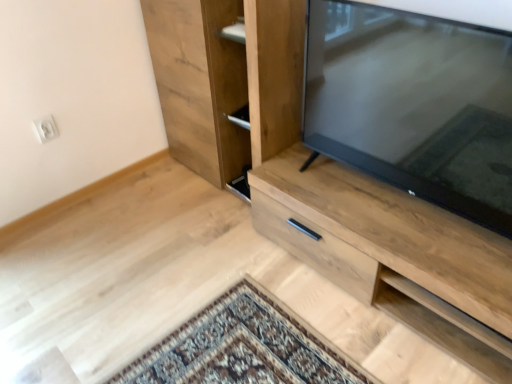
Question: From the image's perspective, would you say matte black tv at right is shown under natural wood cupboard at center?

Choices:
 (A) yes
 (B) no

Answer: (A)

Question: From a real-world perspective, is matte black tv at right positioned under natural wood cupboard at center based on gravity?

Choices:
 (A) yes
 (B) no

Answer: (B)

Question: Is matte black tv at right far from natural wood cupboard at center?

Choices:
 (A) yes
 (B) no

Answer: (B)

Question: Does matte black tv at right have a greater width compared to natural wood cupboard at center?

Choices:
 (A) yes
 (B) no

Answer: (B)

Question: Is matte black tv at right not inside natural wood cupboard at center?

Choices:
 (A) yes
 (B) no

Answer: (A)

Question: Is the depth of matte black tv at right greater than that of natural wood cupboard at center?

Choices:
 (A) yes
 (B) no

Answer: (B)

Question: Does matte black tv at right have a larger size compared to light wood cabinet at center?

Choices:
 (A) no
 (B) yes

Answer: (A)

Question: Is matte black tv at right outside of light wood cabinet at center?

Choices:
 (A) yes
 (B) no

Answer: (A)

Question: From the image's perspective, would you say matte black tv at right is positioned over light wood cabinet at center?

Choices:
 (A) no
 (B) yes

Answer: (B)

Question: Does matte black tv at right appear on the right side of light wood cabinet at center?

Choices:
 (A) yes
 (B) no

Answer: (B)

Question: From a real-world perspective, is matte black tv at right located higher than light wood cabinet at center?

Choices:
 (A) yes
 (B) no

Answer: (A)

Question: Can you confirm if matte black tv at right is wider than light wood cabinet at center?

Choices:
 (A) yes
 (B) no

Answer: (B)

Question: Are light wood cabinet at center and natural wood cupboard at center located far from each other?

Choices:
 (A) no
 (B) yes

Answer: (A)